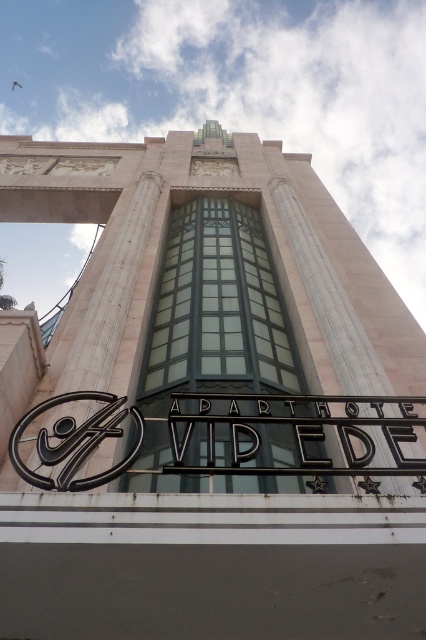
What is located at the point with coordinates (293, 433) on the building facade?

The point at coordinates (293, 433) indicates the location of the black metal sign at center.

You are standing in front of the hotel facade and want to locate two points marked on the building. The first point is at coordinates point (x=86, y=451) and the second is at point (x=74, y=400). Which of these two points is closer to you?

Point (x=86, y=451) is in front of point (x=74, y=400), so the first point is closer to you.

You are standing at the point marked as point (195,422) and want to walk to the entrance of the building. The entrance is located between the two decorative reliefs above the large rectangular window. The distance between the two reliefs is 13.57 meters. If you walk straight towards the entrance, will you have enough space to pass through the gap between them?

The two decorative reliefs are 13.57 meters apart, so yes, there is sufficient space to walk straight through the gap between them as the distance is wide enough for a person to pass comfortably.